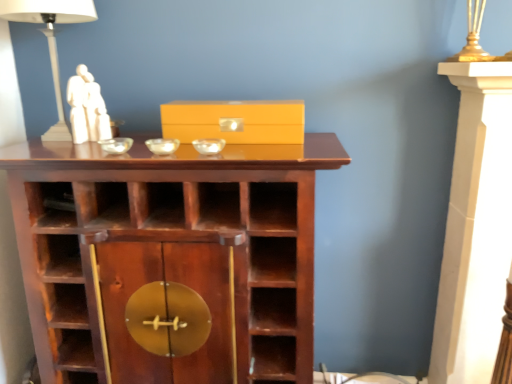
Locate an element on the screen. transparent glass bowl at center, positioned as the first glass bowl in right-to-left order is located at coordinates 209,146.

Find the location of a particular element. white marble statue at upper left is located at coordinates click(x=87, y=108).

What is the approximate height of transparent glass bowl at center, which appears as the second glass bowl when viewed from the left?

transparent glass bowl at center, which appears as the second glass bowl when viewed from the left, is 1.13 inches tall.

Identify the location of transparent glass bowl at center, the third glass bowl in the left-to-right sequence. The height and width of the screenshot is (384, 512). (209, 146).

From a real-world perspective, which object rests below the other?

In real-world perspective, clear glass bowl at center, acting as the third glass bowl starting from the right, is lower.

Which object is wider, white ceramic table lamp at upper left or clear glass bowl at center, the 1th glass bowl positioned from the left?

Wider between the two is white ceramic table lamp at upper left.

Which object is further away from the camera, white ceramic table lamp at upper left or clear glass bowl at center, the 1th glass bowl positioned from the left?

white ceramic table lamp at upper left.

From the image's perspective, is brown wood shelf at center positioned above or below white marble statue at upper left?

From the image's perspective, brown wood shelf at center appears below white marble statue at upper left.

Where is `sculpture above the brown wood shelf at center (from the image's perspective)`? Image resolution: width=512 pixels, height=384 pixels. sculpture above the brown wood shelf at center (from the image's perspective) is located at coordinates (87, 108).

Would you say brown wood shelf at center is a long distance from white marble statue at upper left?

They are positioned close to each other.

Is transparent glass bowl at center, the third glass bowl in the left-to-right sequence, completely or partially outside of brown wood shelf at center?

Actually, transparent glass bowl at center, the third glass bowl in the left-to-right sequence, is at least partially inside brown wood shelf at center.

Is transparent glass bowl at center, the third glass bowl in the left-to-right sequence, smaller than brown wood shelf at center?

Yes.

From a real-world perspective, is transparent glass bowl at center, the third glass bowl in the left-to-right sequence, physically located above or below brown wood shelf at center?

transparent glass bowl at center, the third glass bowl in the left-to-right sequence, is above brown wood shelf at center.

Is transparent glass bowl at center, the third glass bowl in the left-to-right sequence, wider than brown wood shelf at center?

Incorrect, the width of transparent glass bowl at center, the third glass bowl in the left-to-right sequence, does not surpass that of brown wood shelf at center.

Can you confirm if clear glass bowl at center, the 1th glass bowl positioned from the left, is shorter than brown wood shelf at center?

Correct, clear glass bowl at center, the 1th glass bowl positioned from the left, is not as tall as brown wood shelf at center.

From the image's perspective, between clear glass bowl at center, the 1th glass bowl positioned from the left, and brown wood shelf at center, which one is located above?

clear glass bowl at center, the 1th glass bowl positioned from the left, is shown above in the image.

Is clear glass bowl at center, the 1th glass bowl positioned from the left, to the right of brown wood shelf at center from the viewer's perspective?

No, clear glass bowl at center, the 1th glass bowl positioned from the left, is not to the right of brown wood shelf at center.

From a real-world perspective, which object rests below the other?

From a 3D spatial view, brown wood shelf at center is below.

In the scene shown: Does clear glass bowl at center, the 1th glass bowl positioned from the left, have a lesser height compared to transparent glass bowl at center, positioned as the first glass bowl in right-to-left order?

Indeed, clear glass bowl at center, the 1th glass bowl positioned from the left, has a lesser height compared to transparent glass bowl at center, positioned as the first glass bowl in right-to-left order.

Are clear glass bowl at center, acting as the third glass bowl starting from the right, and transparent glass bowl at center, the third glass bowl in the left-to-right sequence, making contact?

No, clear glass bowl at center, acting as the third glass bowl starting from the right, is not with transparent glass bowl at center, the third glass bowl in the left-to-right sequence.

Is clear glass bowl at center, acting as the third glass bowl starting from the right, oriented away from transparent glass bowl at center, the third glass bowl in the left-to-right sequence?

No.

From the image's perspective, between matte yellow box at center and brown wood shelf at center, who is located below?

brown wood shelf at center.

Is matte yellow box at center positioned beyond the bounds of brown wood shelf at center?

→ Yes.

Which object is wider, matte yellow box at center or brown wood shelf at center?

brown wood shelf at center.

Would you consider matte yellow box at center to be distant from brown wood shelf at center?

That's not correct — matte yellow box at center is a little close to brown wood shelf at center.

Does matte yellow box at center have a greater height compared to transparent glass bowl at center, positioned as the first glass bowl in right-to-left order?

Yes.

Between matte yellow box at center and transparent glass bowl at center, positioned as the first glass bowl in right-to-left order, which one has larger width?

matte yellow box at center.

Can you confirm if matte yellow box at center is positioned to the right of transparent glass bowl at center, the third glass bowl in the left-to-right sequence?

Yes, matte yellow box at center is to the right of transparent glass bowl at center, the third glass bowl in the left-to-right sequence.

Considering the sizes of objects matte yellow box at center and transparent glass bowl at center, positioned as the first glass bowl in right-to-left order, in the image provided, who is bigger, matte yellow box at center or transparent glass bowl at center, positioned as the first glass bowl in right-to-left order,?

Bigger between the two is matte yellow box at center.

Locate an element on the screen. The image size is (512, 384). table lamp located above the clear glass bowl at center, acting as the third glass bowl starting from the right (from the image's perspective) is located at coordinates (51, 39).

Find the location of a particular element. sculpture above the brown wood shelf at center (from a real-world perspective) is located at coordinates (87, 108).

From the picture: Which object lies nearer to the anchor point matte yellow box at center, white ceramic table lamp at upper left or transparent glass bowl at center, which appears as the second glass bowl when viewed from the left?

transparent glass bowl at center, which appears as the second glass bowl when viewed from the left, is positioned closer to the anchor matte yellow box at center.

When comparing their distances from white marble statue at upper left, does matte yellow box at center or transparent glass bowl at center, which is the 2th glass bowl in right-to-left order, seem further?

matte yellow box at center lies further to white marble statue at upper left than the other object.

From the image, which object appears to be nearer to transparent glass bowl at center, which is the 2th glass bowl in right-to-left order, brown wood shelf at center or white marble statue at upper left?

The object closer to transparent glass bowl at center, which is the 2th glass bowl in right-to-left order, is white marble statue at upper left.

Considering their positions, is brown wood shelf at center positioned closer to white marble statue at upper left than transparent glass bowl at center, which appears as the second glass bowl when viewed from the left?

The object closer to white marble statue at upper left is transparent glass bowl at center, which appears as the second glass bowl when viewed from the left.

Based on their spatial positions, is transparent glass bowl at center, positioned as the first glass bowl in right-to-left order, or transparent glass bowl at center, which is the 2th glass bowl in right-to-left order, closer to white ceramic table lamp at upper left?

The object closer to white ceramic table lamp at upper left is transparent glass bowl at center, which is the 2th glass bowl in right-to-left order.

Which object lies nearer to the anchor point matte yellow box at center, transparent glass bowl at center, the third glass bowl in the left-to-right sequence, or white marble statue at upper left?

transparent glass bowl at center, the third glass bowl in the left-to-right sequence, is positioned closer to the anchor matte yellow box at center.

Looking at the image, which one is located closer to brown wood shelf at center, matte yellow box at center or clear glass bowl at center, acting as the third glass bowl starting from the right?

Among the two, matte yellow box at center is located nearer to brown wood shelf at center.

Which object lies further to the anchor point brown wood shelf at center, transparent glass bowl at center, which appears as the second glass bowl when viewed from the left, or white marble statue at upper left?

white marble statue at upper left.

I want to click on sculpture between white ceramic table lamp at upper left and matte yellow box at center from left to right, so click(87, 108).

The image size is (512, 384). Find the location of `sculpture between white ceramic table lamp at upper left and brown wood shelf at center in the vertical direction`. sculpture between white ceramic table lamp at upper left and brown wood shelf at center in the vertical direction is located at coordinates (87, 108).

Identify the location of glass bowl located between transparent glass bowl at center, which appears as the second glass bowl when viewed from the left, and matte yellow box at center in the left-right direction. The image size is (512, 384). (209, 146).

Locate an element on the screen. The width and height of the screenshot is (512, 384). glass bowl situated between clear glass bowl at center, acting as the third glass bowl starting from the right, and transparent glass bowl at center, positioned as the first glass bowl in right-to-left order, from left to right is located at coordinates (162, 146).